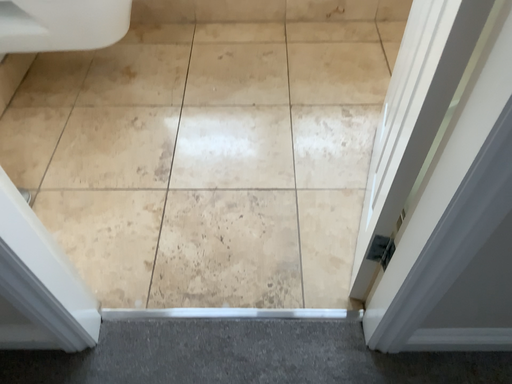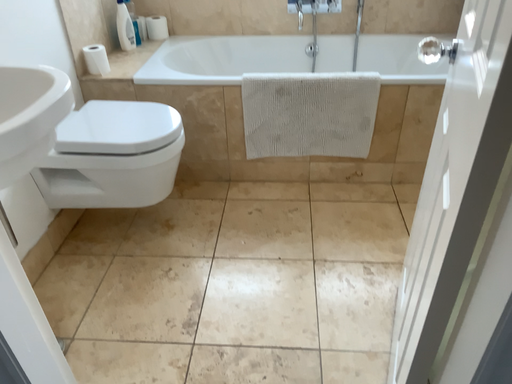
Question: How did the camera likely rotate when shooting the video?

Choices:
 (A) rotated upward
 (B) rotated downward

Answer: (A)